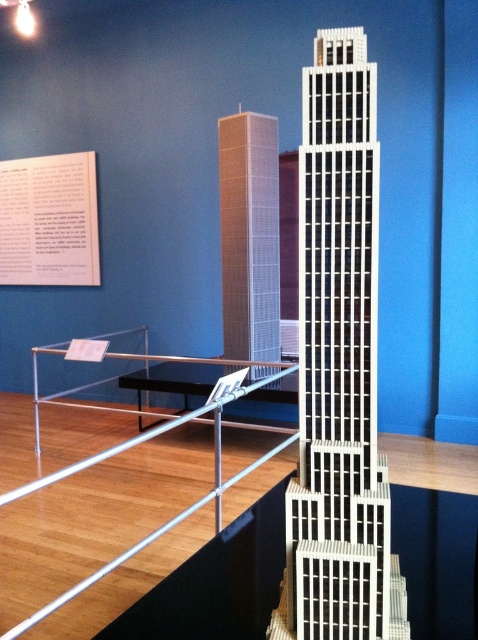
Question: Is white textured building at center wider than white grid-patterned tower at center?

Choices:
 (A) yes
 (B) no

Answer: (B)

Question: Which object appears farthest from the camera in this image?

Choices:
 (A) white textured building at center
 (B) white grid-patterned tower at center

Answer: (B)

Question: Does white textured building at center have a greater width compared to white grid-patterned tower at center?

Choices:
 (A) no
 (B) yes

Answer: (A)

Question: Can you confirm if white textured building at center is wider than white grid-patterned tower at center?

Choices:
 (A) yes
 (B) no

Answer: (B)

Question: Which point is closer to the camera?

Choices:
 (A) (267, 355)
 (B) (367, 152)

Answer: (B)